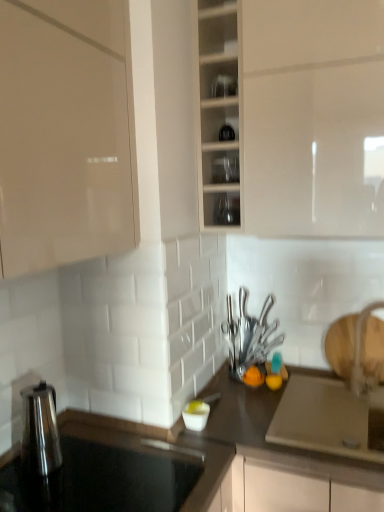
The height and width of the screenshot is (512, 384). I want to click on vacant space that is in between white glossy faucet at right and white glossy bowl at center, marked as the third tableware in a back-to-front arrangement, so click(x=300, y=406).